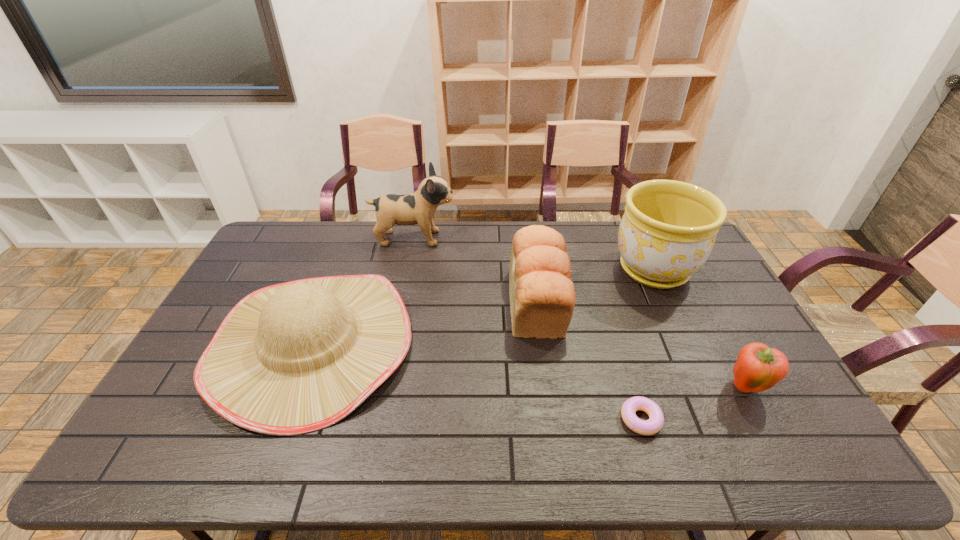
Identify the location of vacant area that lies between the shortest object and the pepper. (693, 403).

What are the coordinates of `free space between the pepper and the flowerpot` in the screenshot? It's located at (700, 328).

Identify which object is the fifth closest to the puppy. Please provide its 2D coordinates. Your answer should be formatted as a tuple, i.e. [(x, y)], where the tuple contains the x and y coordinates of a point satisfying the conditions above.

[(758, 368)]

Select which object is the closest to the pepper. Please provide its 2D coordinates. Your answer should be formatted as a tuple, i.e. [(x, y)], where the tuple contains the x and y coordinates of a point satisfying the conditions above.

[(656, 418)]

Find the location of a particular element. vacant area in the image that satisfies the following two spatial constraints: 1. on the back side of the pepper; 2. on the right side of the shortest object is located at coordinates (632, 388).

Image resolution: width=960 pixels, height=540 pixels. Identify the location of vacant area in the image that satisfies the following two spatial constraints: 1. at the face of the puppy; 2. on the back side of the shortest object. (378, 419).

This screenshot has width=960, height=540. I want to click on free space that satisfies the following two spatial constraints: 1. on the back side of the fourth object from right to left; 2. on the right side of the flowerpot, so click(x=533, y=269).

Image resolution: width=960 pixels, height=540 pixels. What are the coordinates of `vacant space that satisfies the following two spatial constraints: 1. at the face of the puppy; 2. on the right side of the doughnut` in the screenshot? It's located at (378, 419).

Find the location of a particular element. The width and height of the screenshot is (960, 540). vacant space that satisfies the following two spatial constraints: 1. at the face of the flowerpot; 2. on the left side of the puppy is located at coordinates (407, 269).

Identify the location of vacant area in the image that satisfies the following two spatial constraints: 1. at the face of the flowerpot; 2. on the left side of the puppy. This screenshot has height=540, width=960. (407, 269).